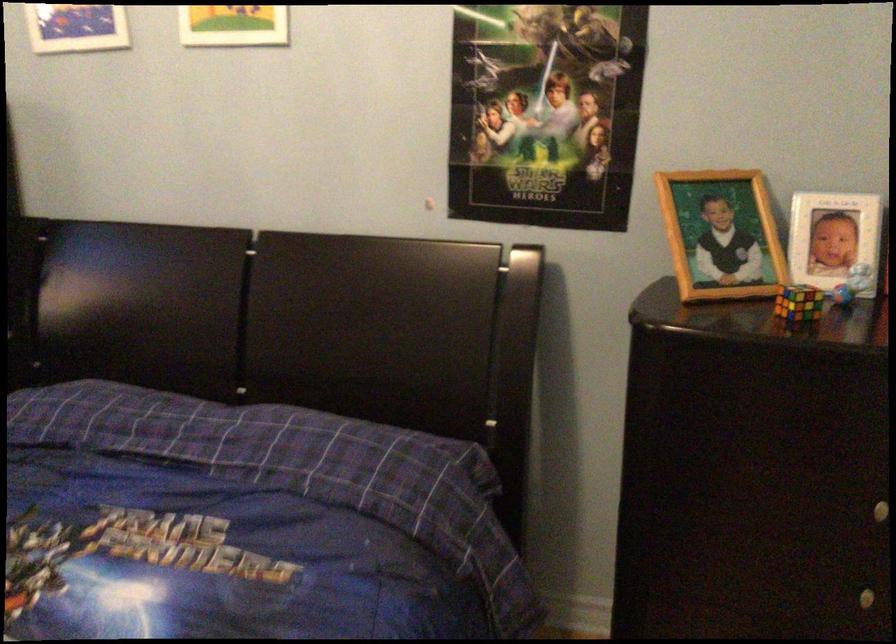
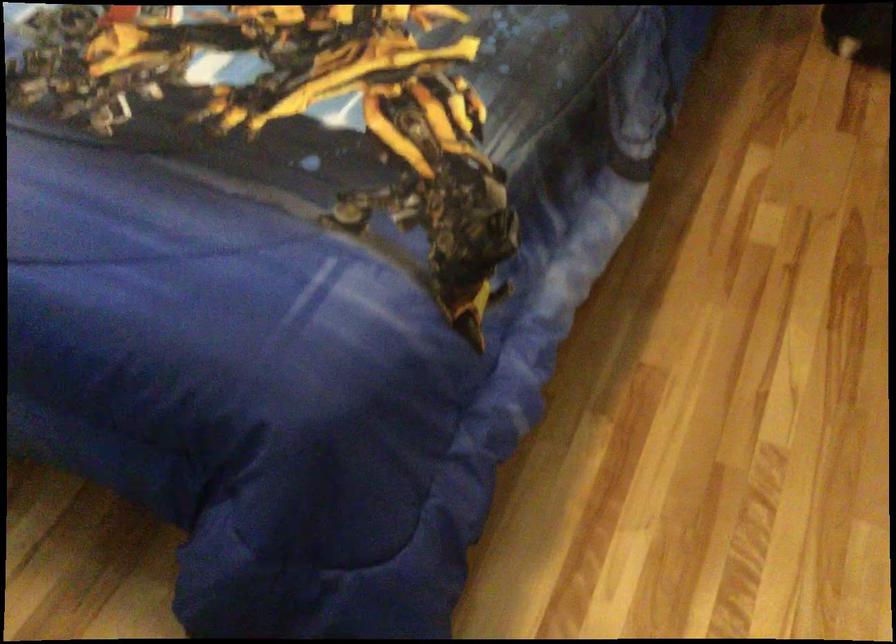
Question: Based on the continuous images, in which direction is the camera rotating? Reply with the corresponding letter.

Choices:
 (A) Left
 (B) Right
 (C) Up
 (D) Down

Answer: (D)